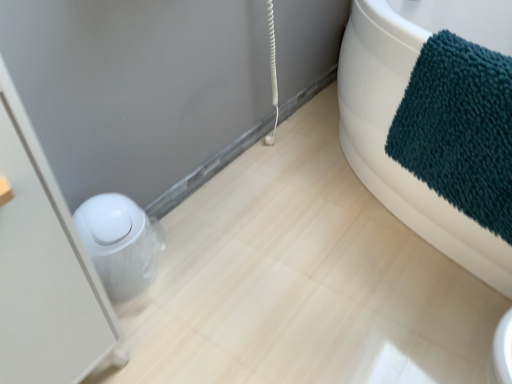
Question: Does white glossy trash can at left have a lesser height compared to teal plush towel at upper right?

Choices:
 (A) yes
 (B) no

Answer: (B)

Question: Can you confirm if white glossy trash can at left is positioned to the left of teal plush towel at upper right?

Choices:
 (A) yes
 (B) no

Answer: (A)

Question: Considering the relative sizes of white glossy trash can at left and teal plush towel at upper right in the image provided, is white glossy trash can at left smaller than teal plush towel at upper right?

Choices:
 (A) yes
 (B) no

Answer: (B)

Question: From the image's perspective, does white glossy trash can at left appear higher than teal plush towel at upper right?

Choices:
 (A) no
 (B) yes

Answer: (A)

Question: Is teal plush towel at upper right at the back of white glossy trash can at left?

Choices:
 (A) no
 (B) yes

Answer: (A)

Question: From a real-world perspective, does white glossy trash can at left stand above teal plush towel at upper right?

Choices:
 (A) yes
 (B) no

Answer: (A)

Question: Is white glossy toilet bowl at lower left oriented away from teal plush towel at upper right?

Choices:
 (A) yes
 (B) no

Answer: (B)

Question: Can you confirm if white glossy toilet bowl at lower left is wider than teal plush towel at upper right?

Choices:
 (A) no
 (B) yes

Answer: (A)

Question: From a real-world perspective, is white glossy toilet bowl at lower left positioned over teal plush towel at upper right based on gravity?

Choices:
 (A) yes
 (B) no

Answer: (B)

Question: Is white glossy toilet bowl at lower left outside teal plush towel at upper right?

Choices:
 (A) yes
 (B) no

Answer: (A)

Question: From the image's perspective, is white glossy toilet bowl at lower left over teal plush towel at upper right?

Choices:
 (A) yes
 (B) no

Answer: (B)

Question: Is white glossy toilet bowl at lower left placed right next to teal plush towel at upper right?

Choices:
 (A) yes
 (B) no

Answer: (B)

Question: From a real-world perspective, is teal plush towel at upper right located beneath white glossy toilet bowl at lower left?

Choices:
 (A) yes
 (B) no

Answer: (B)